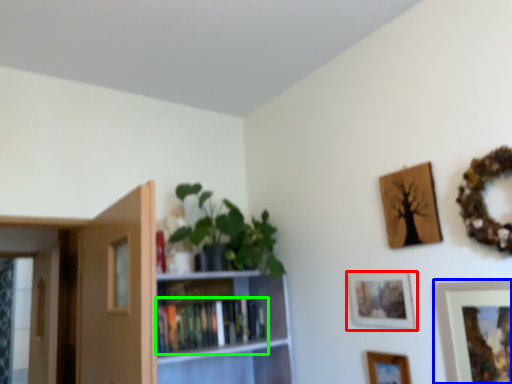
Question: Which object is the farthest from picture frame (highlighted by a red box)? Choose among these: picture frame (highlighted by a blue box) or book (highlighted by a green box).

Choices:
 (A) picture frame
 (B) book

Answer: (B)